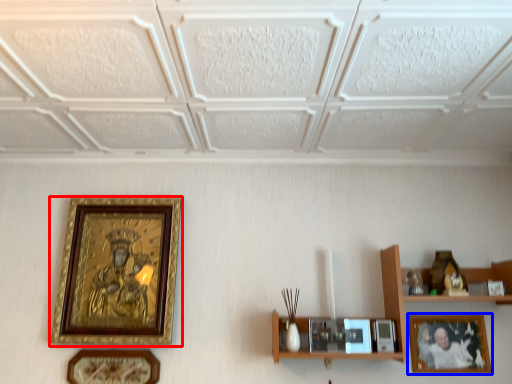
Question: Which object is closer to the camera taking this photo, picture frame (highlighted by a red box) or picture frame (highlighted by a blue box)?

Choices:
 (A) picture frame
 (B) picture frame

Answer: (A)